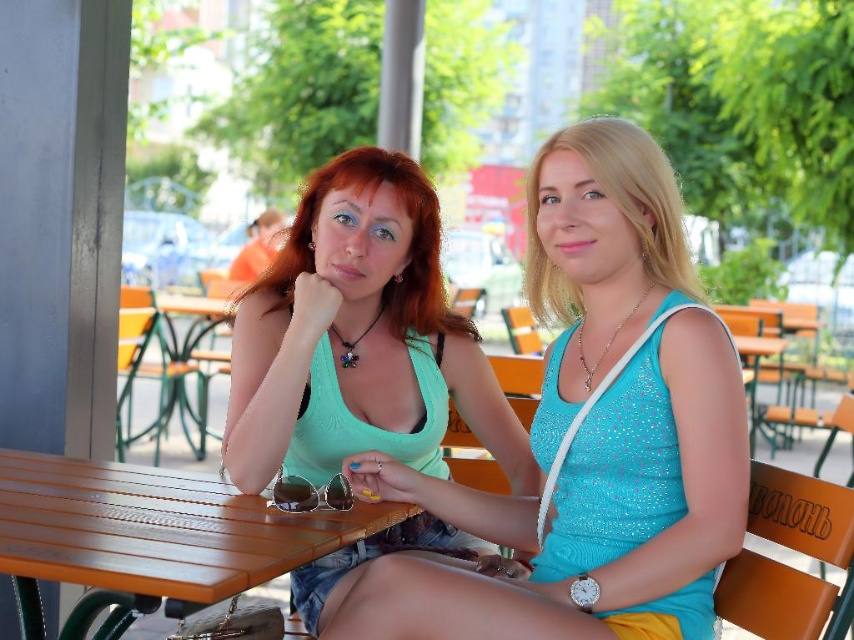
Find the location of `matte green tank top at center`. matte green tank top at center is located at coordinates (594, 429).

Describe the element at coordinates (594, 429) in the screenshot. I see `matte green tank top at center` at that location.

Identify the location of matte green tank top at center. (594, 429).

Between wooden at center and wooden table at center, which one appears on the right side from the viewer's perspective?

From the viewer's perspective, wooden at center appears more on the right side.

Does wooden at center have a greater height compared to wooden table at center?

Incorrect, wooden at center's height is not larger of wooden table at center's.

Find the location of a particular element. wooden at center is located at coordinates (156, 529).

Find the location of `wooden at center`. wooden at center is located at coordinates (156, 529).

Between green matte tank top at center and wooden table at center, which one is positioned lower?

green matte tank top at center is below.

Between point (437, 404) and point (230, 291), which one is positioned behind?

Point (230, 291)

Find the location of a particular element. The width and height of the screenshot is (854, 640). green matte tank top at center is located at coordinates (x=360, y=339).